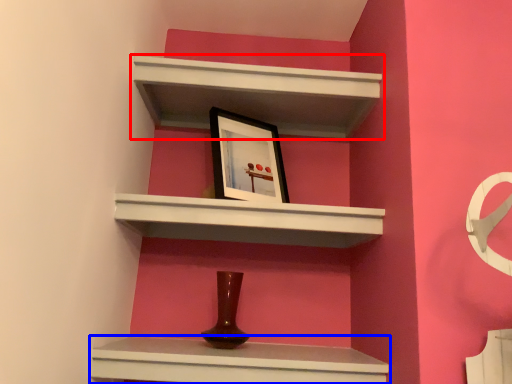
Question: Which object appears farthest to the camera in this image, shelf (highlighted by a red box) or shelf (highlighted by a blue box)?

Choices:
 (A) shelf
 (B) shelf

Answer: (A)